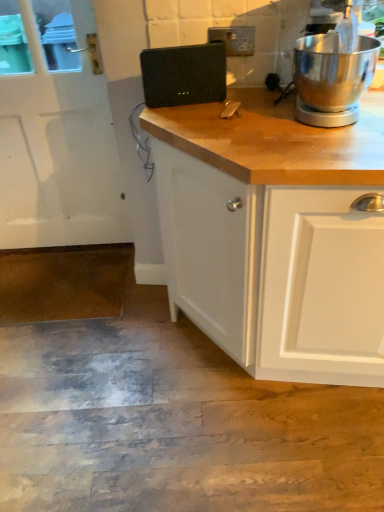
Question: Is white matte screen door at left in front of or behind polished stainless steel stand mixer at upper right in the image?

Choices:
 (A) front
 (B) behind

Answer: (B)

Question: From the image's perspective, is white matte screen door at left above or below polished stainless steel stand mixer at upper right?

Choices:
 (A) below
 (B) above

Answer: (A)

Question: Which object is positioned farthest from the polished stainless steel stand mixer at upper right?

Choices:
 (A) black plastic speaker at center
 (B) white matte screen door at left

Answer: (B)

Question: Based on their relative distances, which object is nearer to the white matte screen door at left?

Choices:
 (A) black plastic speaker at center
 (B) polished stainless steel stand mixer at upper right

Answer: (A)